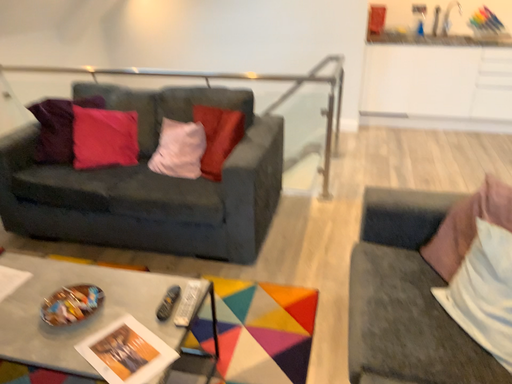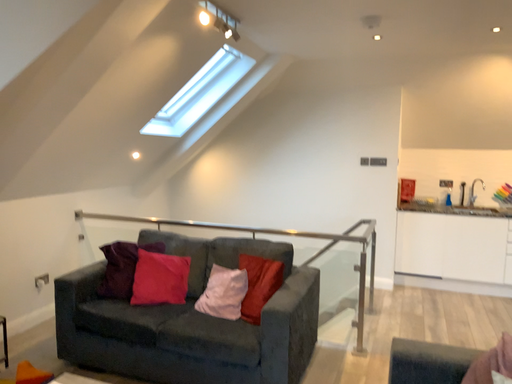
Question: Which way did the camera rotate in the video?

Choices:
 (A) rotated downward
 (B) rotated upward

Answer: (B)